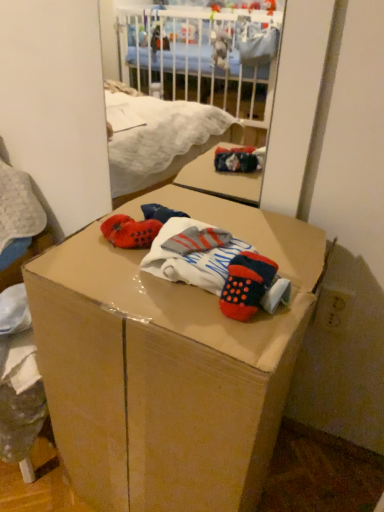
What do you see at coordinates (191, 258) in the screenshot? This screenshot has width=384, height=512. I see `knitted wool socks at center` at bounding box center [191, 258].

Identify the location of knitted wool socks at center. This screenshot has width=384, height=512. (191, 258).

Measure the distance between cardboard box at center and camera.

The distance of cardboard box at center from camera is 48.67 centimeters.

The height and width of the screenshot is (512, 384). In order to click on cardboard box at center in this screenshot , I will do `click(167, 365)`.

This screenshot has width=384, height=512. What do you see at coordinates (167, 365) in the screenshot?
I see `cardboard box at center` at bounding box center [167, 365].

Identify the location of knitted wool socks at center. (191, 258).

Can you confirm if cardboard box at center is positioned to the left of knitted wool socks at center?

Indeed, cardboard box at center is positioned on the left side of knitted wool socks at center.

Considering the relative positions of cardboard box at center and knitted wool socks at center in the image provided, is cardboard box at center behind knitted wool socks at center?

That is False.

Considering the positions of points (183, 346) and (201, 274), is point (183, 346) farther from camera compared to point (201, 274)?

That is False.

From the image's perspective, does cardboard box at center appear higher than knitted wool socks at center?

No, from the image's perspective, cardboard box at center is not on top of knitted wool socks at center.

From a real-world perspective, which object rests below the other?

From a 3D spatial view, cardboard box at center is below.

Considering the relative sizes of cardboard box at center and knitted wool socks at center in the image provided, is cardboard box at center wider than knitted wool socks at center?

Correct, the width of cardboard box at center exceeds that of knitted wool socks at center.

Which of these two, cardboard box at center or knitted wool socks at center, stands taller?

Standing taller between the two is cardboard box at center.

Which of these two, cardboard box at center or knitted wool socks at center, is bigger?

cardboard box at center is bigger.

Which is correct: cardboard box at center is inside knitted wool socks at center, or outside of it?

cardboard box at center is spatially situated outside knitted wool socks at center.

Are cardboard box at center and knitted wool socks at center making contact?

No, cardboard box at center is not in contact with knitted wool socks at center.

Is cardboard box at center aimed at knitted wool socks at center?

No, cardboard box at center is not facing towards knitted wool socks at center.

How different are the orientations of cardboard box at center and knitted wool socks at center in degrees?

The angle between the facing direction of cardboard box at center and the facing direction of knitted wool socks at center is 2.89 degrees.

Identify the location of baby clothe that is above the cardboard box at center (from a real-world perspective). (191, 258).

Considering the positions of objects knitted wool socks at center and cardboard box at center in the image provided, who is more to the left, knitted wool socks at center or cardboard box at center?

cardboard box at center.

Considering the relative positions of knitted wool socks at center and cardboard box at center in the image provided, is knitted wool socks at center behind cardboard box at center?

That is True.

Between point (165, 229) and point (245, 225), which one is positioned behind?

The point (245, 225) is more distant.

From the image's perspective, relative to cardboard box at center, is knitted wool socks at center above or below?

Clearly, from the image's perspective, knitted wool socks at center is above cardboard box at center.

From a real-world perspective, who is located lower, knitted wool socks at center or cardboard box at center?

cardboard box at center.

Which of these two, knitted wool socks at center or cardboard box at center, is thinner?

knitted wool socks at center is thinner.

In terms of height, does knitted wool socks at center look taller or shorter compared to cardboard box at center?

Clearly, knitted wool socks at center is shorter compared to cardboard box at center.

Is knitted wool socks at center bigger than cardboard box at center?

Actually, knitted wool socks at center might be smaller than cardboard box at center.

Is knitted wool socks at center situated inside cardboard box at center or outside?

knitted wool socks at center exists entirely within cardboard box at center.

In the scene shown: Is knitted wool socks at center positioned far away from cardboard box at center?

They are positioned close to each other.

Is knitted wool socks at center looking in the opposite direction of cardboard box at center?

That's not correct — knitted wool socks at center is not looking away from cardboard box at center.

Locate an element on the screen. The width and height of the screenshot is (384, 512). baby clothe above the cardboard box at center (from a real-world perspective) is located at coordinates (191, 258).

Find the location of a particular element. baby clothe that is behind the cardboard box at center is located at coordinates (191, 258).

Identify the location of box lying in front of the knitted wool socks at center. (167, 365).